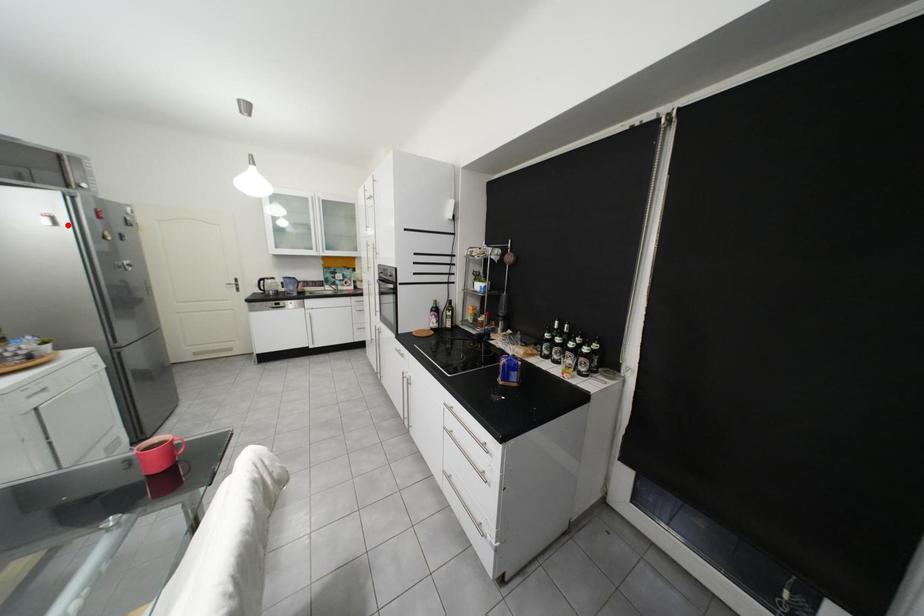
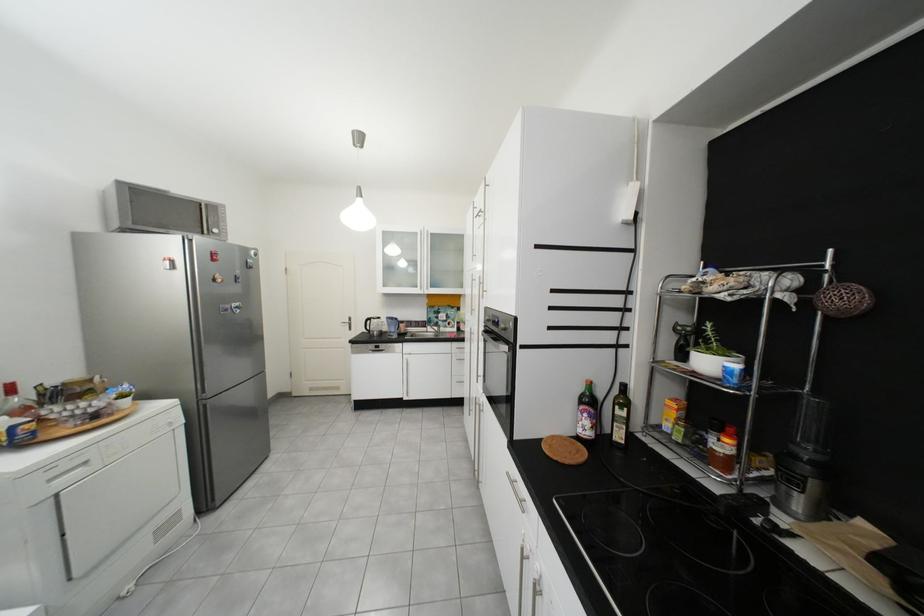
The point at the highlighted location is marked in the first image. Where is the corresponding point in the second image?

(185, 269)